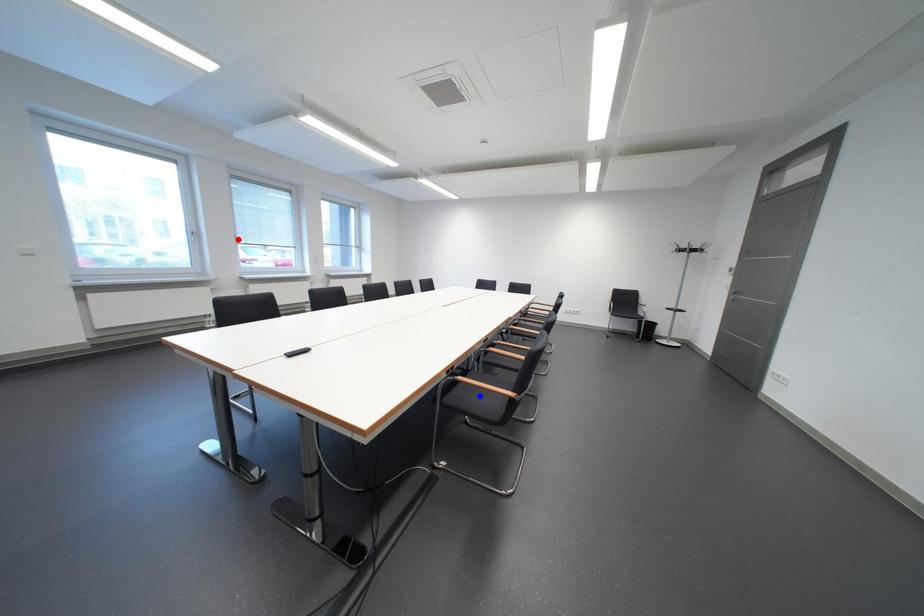
Question: In the image, two points are highlighted. Which point is nearer to the camera? Reply with the corresponding letter.

Choices:
 (A) blue point
 (B) red point

Answer: (A)